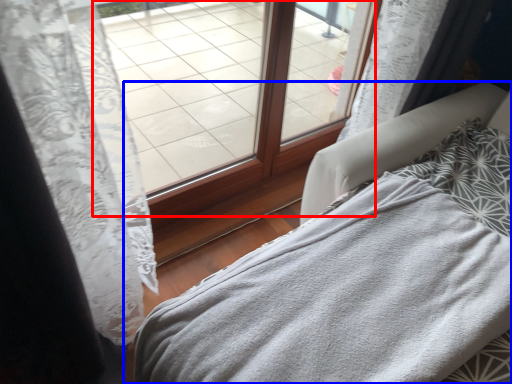
Question: Which object is closer to the camera taking this photo, window (highlighted by a red box) or furniture (highlighted by a blue box)?

Choices:
 (A) window
 (B) furniture

Answer: (B)